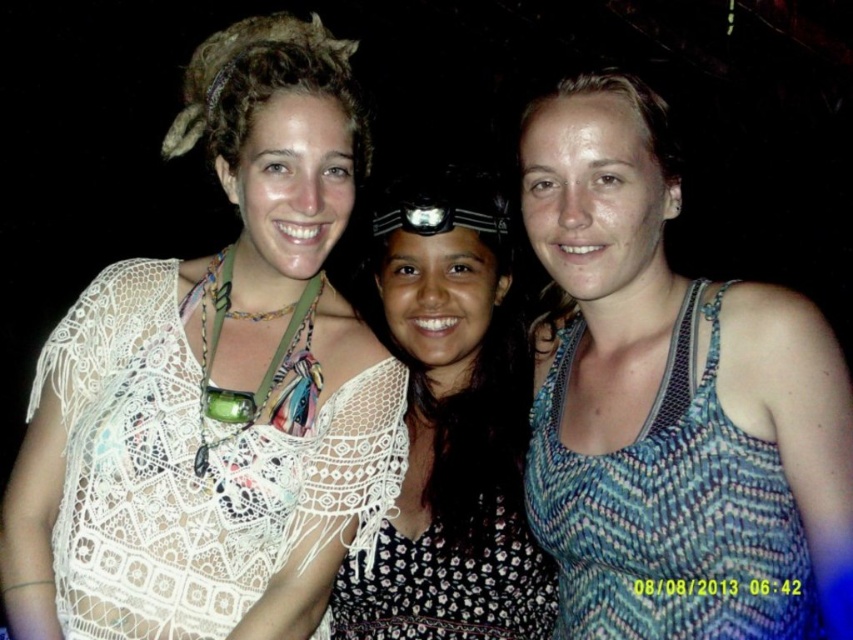
Question: Which of the following is the closest to the observer?

Choices:
 (A) (305, 36)
 (B) (556, 369)

Answer: (A)

Question: Based on their relative distances, which object is nearer to the black lace dress at center?

Choices:
 (A) blue woven tank top at right
 (B) white lace top at upper left

Answer: (B)

Question: Can you confirm if black lace dress at center is wider than blue woven tank top at right?

Choices:
 (A) no
 (B) yes

Answer: (A)

Question: Does white lace top at upper left have a smaller size compared to blue woven tank top at right?

Choices:
 (A) no
 (B) yes

Answer: (A)

Question: Is black lace dress at center smaller than blue woven tank top at right?

Choices:
 (A) no
 (B) yes

Answer: (A)

Question: Which point is farther from the camera taking this photo?

Choices:
 (A) (695, 417)
 (B) (291, 154)

Answer: (B)